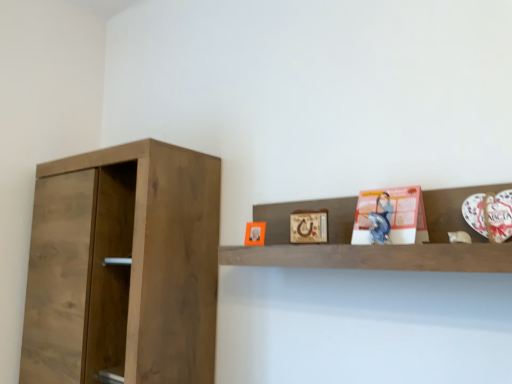
Question: Which direction should I rotate to face matte orange picture frame at upper center, which is the 1th picture frame in left-to-right order, — up or down?

Choices:
 (A) up
 (B) down

Answer: (B)

Question: Is matte pink paper at upper right positioned with its back to wooden shelf at upper center?

Choices:
 (A) yes
 (B) no

Answer: (A)

Question: Is matte pink paper at upper right at the left side of wooden shelf at upper center?

Choices:
 (A) yes
 (B) no

Answer: (B)

Question: Is wooden shelf at upper center completely or partially inside matte pink paper at upper right?

Choices:
 (A) no
 (B) yes

Answer: (A)

Question: Can you confirm if matte pink paper at upper right is thinner than wooden shelf at upper center?

Choices:
 (A) no
 (B) yes

Answer: (B)

Question: From the image's perspective, is matte pink paper at upper right on top of wooden shelf at upper center?

Choices:
 (A) yes
 (B) no

Answer: (A)

Question: Is matte pink paper at upper right with wooden shelf at upper center?

Choices:
 (A) yes
 (B) no

Answer: (B)

Question: Is wooden picture frame at upper center, placed as the 1th picture frame when sorted from right to left, with matte orange picture frame at upper center, which is counted as the first picture frame, starting from the back?

Choices:
 (A) yes
 (B) no

Answer: (B)

Question: From the image's perspective, is wooden picture frame at upper center, the 2th picture frame when ordered from back to front, over matte orange picture frame at upper center, which is the 1th picture frame in left-to-right order?

Choices:
 (A) no
 (B) yes

Answer: (B)

Question: Is wooden picture frame at upper center, positioned as the first picture frame in front-to-back order, closer to camera compared to matte orange picture frame at upper center, which is counted as the first picture frame, starting from the back?

Choices:
 (A) yes
 (B) no

Answer: (A)

Question: Considering the relative sizes of wooden picture frame at upper center, which is the second picture frame from left to right, and matte orange picture frame at upper center, which is counted as the first picture frame, starting from the back, in the image provided, is wooden picture frame at upper center, which is the second picture frame from left to right, thinner than matte orange picture frame at upper center, which is counted as the first picture frame, starting from the back,?

Choices:
 (A) no
 (B) yes

Answer: (B)

Question: From a real-world perspective, is wooden picture frame at upper center, positioned as the first picture frame in front-to-back order, located beneath matte orange picture frame at upper center, the second picture frame from the front?

Choices:
 (A) no
 (B) yes

Answer: (A)

Question: Is wooden picture frame at upper center, positioned as the first picture frame in front-to-back order, positioned beyond the bounds of matte orange picture frame at upper center, which is counted as the first picture frame, starting from the back?

Choices:
 (A) no
 (B) yes

Answer: (B)

Question: Considering the relative sizes of wooden shelf at upper center and matte orange picture frame at upper center, which is the 1th picture frame in left-to-right order, in the image provided, is wooden shelf at upper center smaller than matte orange picture frame at upper center, which is the 1th picture frame in left-to-right order,?

Choices:
 (A) yes
 (B) no

Answer: (B)